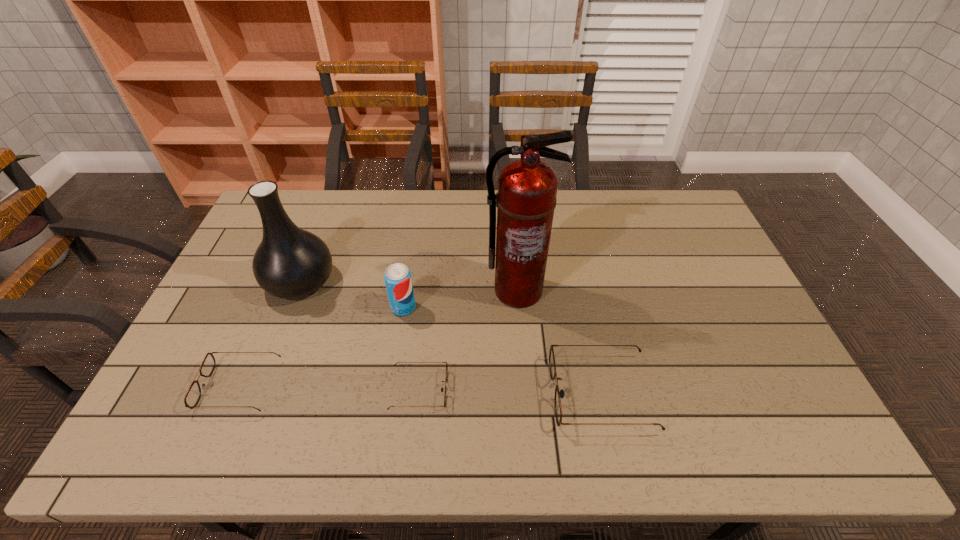
Considering the uniform spacing of sunglassess, where should an additional sunglasses be positioned on the right? Please locate a free spot. Please provide its 2D coordinates. Your answer should be formatted as a tuple, i.e. [(x, y)], where the tuple contains the x and y coordinates of a point satisfying the conditions above.

[(785, 396)]